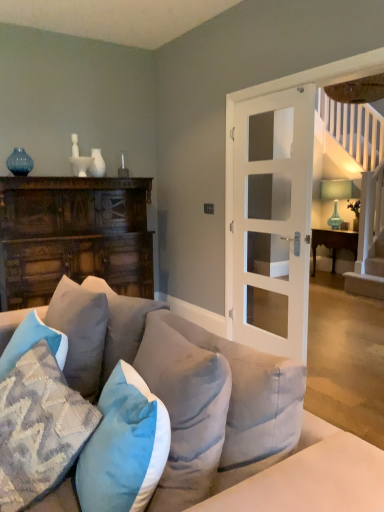
Question: In the image, is dark wood cabinet at left on the left side or the right side of white glass door at center?

Choices:
 (A) left
 (B) right

Answer: (A)

Question: Which is correct: dark wood cabinet at left is inside white glass door at center, or outside of it?

Choices:
 (A) outside
 (B) inside

Answer: (A)

Question: Estimate the real-world distances between objects in this image. Which object is farther from the textured woolen pillow at lower left, which is the second pillow in left-to-right order?

Choices:
 (A) blue velvet pillow at center, the 5th pillow when ordered from left to right
 (B) textured gray pillow at left, which appears as the third pillow when viewed from the left
 (C) velvet blue couch at center
 (D) textured blue pillow at lower left, the first pillow from the left
 (E) white glass door at center

Answer: (C)

Question: Which of these objects is positioned farthest from the wooden table at right?

Choices:
 (A) teal glass vase at upper left
 (B) textured blue pillow at lower left, the first pillow from the left
 (C) blue velvet pillow at center, the 5th pillow when ordered from left to right
 (D) velvet blue couch at center
 (E) white glass door at center

Answer: (C)